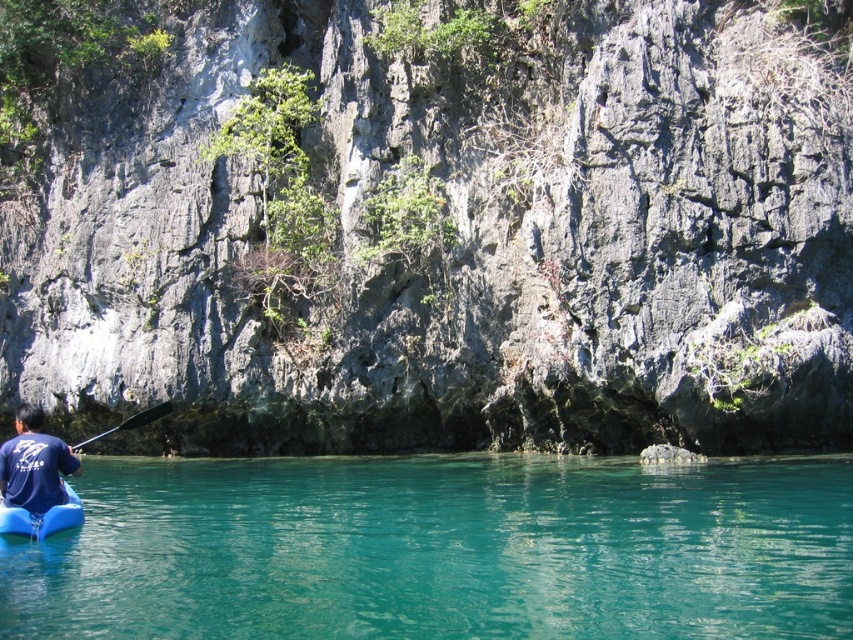
You are standing on the shore of the teal glossy water at lower center and want to reach the gray rock cliff at upper center. Which direction should you move to get closer to the cliff?

To get closer to the gray rock cliff at upper center, you should move towards the upper direction since the cliff is located above the teal glossy water at lower center in the scene.

You are a photographer positioned at the origin point of the scene. The gray rock cliff at upper center is at coordinates 0.373 in the x and 0.531 in the y. If you want to capture the cliff in your shot, which direction should you move your camera to align it with the cliff?

To align your camera with the gray rock cliff at upper center, you should move it towards the coordinates 0.373 in the x and 0.531 in the y, which is the location of the cliff.